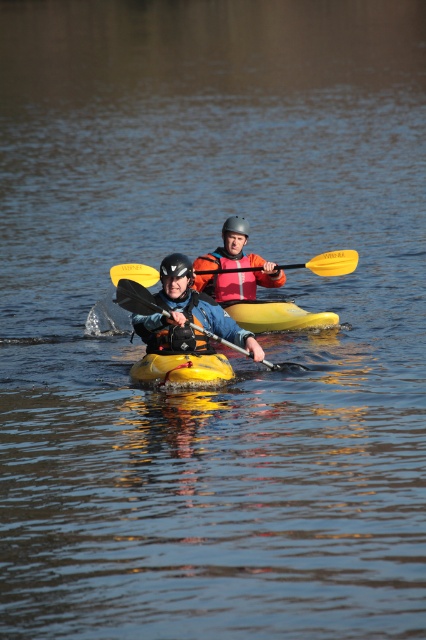
Is yellow matte canoe at center bigger than yellow foam paddle at center?

Yes.

Is yellow matte canoe at center above yellow foam paddle at center?

No.

This screenshot has height=640, width=426. Identify the location of yellow matte canoe at center. (181, 369).

Can you confirm if orange life vest at center is shorter than orange fleece life jacket at center?

No.

What do you see at coordinates (235, 266) in the screenshot? The height and width of the screenshot is (640, 426). I see `orange life vest at center` at bounding box center [235, 266].

Where is `orange life vest at center`? The width and height of the screenshot is (426, 640). orange life vest at center is located at coordinates (235, 266).

Who is more distant from viewer, (239, 273) or (173, 364)?

The point (239, 273) is behind.

Between orange life vest at center and yellow matte canoe at center, which one has more height?

orange life vest at center is taller.

Identify the location of orange life vest at center. (235, 266).

Where is `orange life vest at center`? The image size is (426, 640). orange life vest at center is located at coordinates (235, 266).